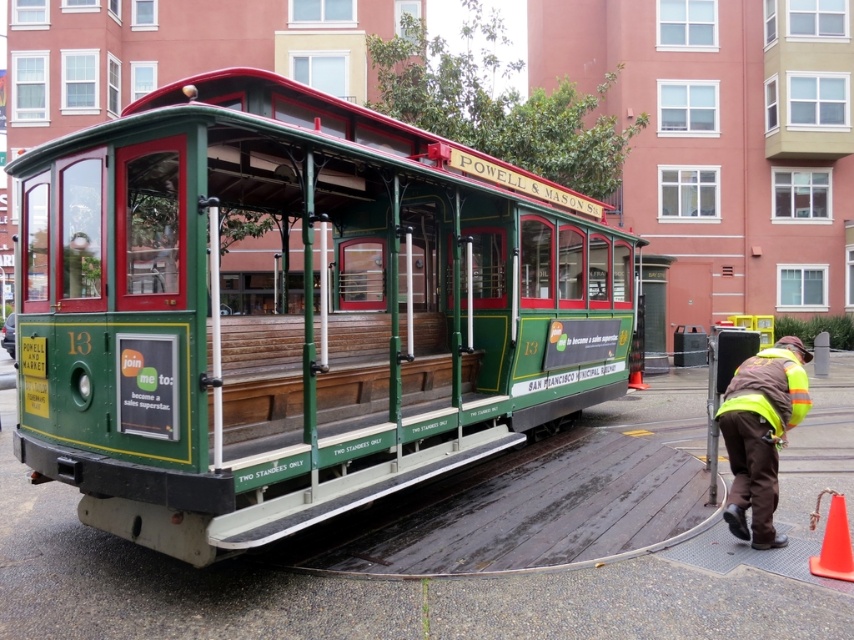
You are standing on the pavement and want to take a photo of the cable car. You notice two points on the car, one at point (747, 358) and the other at point (747, 388). Which point will appear closer to the edge of your camera frame?

Point (747, 388) will appear closer to the edge of your camera frame because it is closer to the camera than point (747, 358).